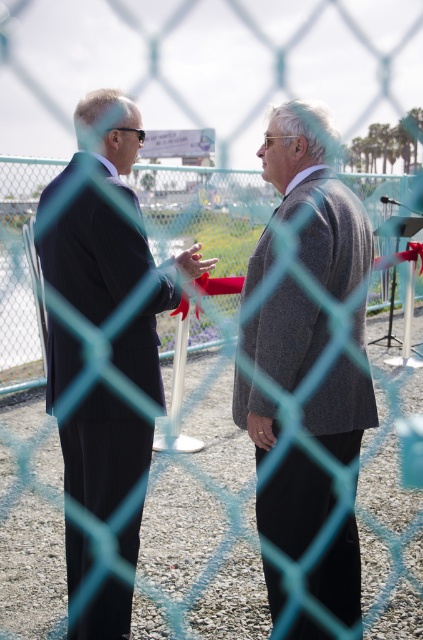
Question: Can you confirm if matte black suit at left is bigger than gray wool suit at center?

Choices:
 (A) yes
 (B) no

Answer: (A)

Question: Is matte black suit at left thinner than gray wool suit at center?

Choices:
 (A) no
 (B) yes

Answer: (A)

Question: Which object appears farthest from the camera in this image?

Choices:
 (A) matte black suit at left
 (B) gray wool suit at center

Answer: (A)

Question: Which point is farther from the camera taking this photo?

Choices:
 (A) (102, 136)
 (B) (291, 192)

Answer: (A)

Question: Where is matte black suit at left located in relation to gray wool suit at center in the image?

Choices:
 (A) right
 (B) left

Answer: (B)